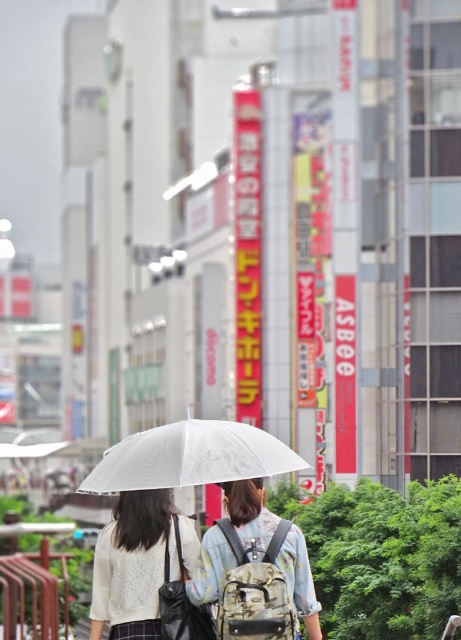
Question: Which is farther from the transparent plastic umbrella at center?

Choices:
 (A) transparent nylon umbrella at center
 (B) white matte umbrella at lower left

Answer: (B)

Question: Is transparent plastic umbrella at center below transparent nylon umbrella at center?

Choices:
 (A) no
 (B) yes

Answer: (B)

Question: Is transparent plastic umbrella at center above white matte umbrella at lower left?

Choices:
 (A) yes
 (B) no

Answer: (B)

Question: Which of the following is the farthest from the observer?

Choices:
 (A) transparent plastic umbrella at center
 (B) transparent nylon umbrella at center

Answer: (A)

Question: Estimate the real-world distances between objects in this image. Which object is closer to the transparent nylon umbrella at center?

Choices:
 (A) white matte umbrella at lower left
 (B) transparent plastic umbrella at center

Answer: (A)

Question: Can you confirm if white matte umbrella at lower left is positioned below transparent nylon umbrella at center?

Choices:
 (A) no
 (B) yes

Answer: (A)